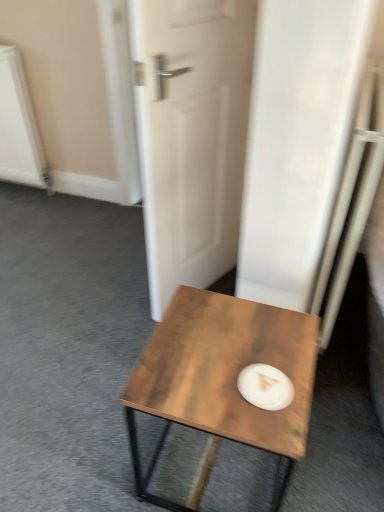
I want to click on unoccupied area in front of white matte paper plate at center, so click(265, 426).